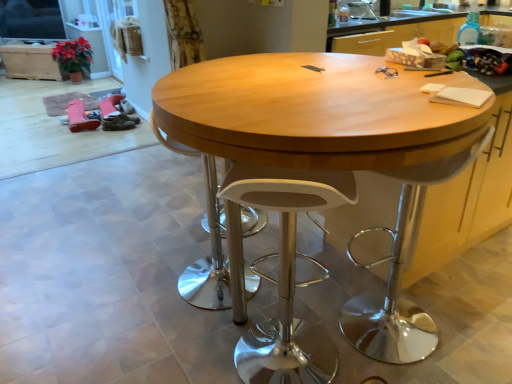
The height and width of the screenshot is (384, 512). I want to click on free point to the left of white plastic swivel chair at right, which is counted as the 2th swivel chair, starting from the left, so click(309, 309).